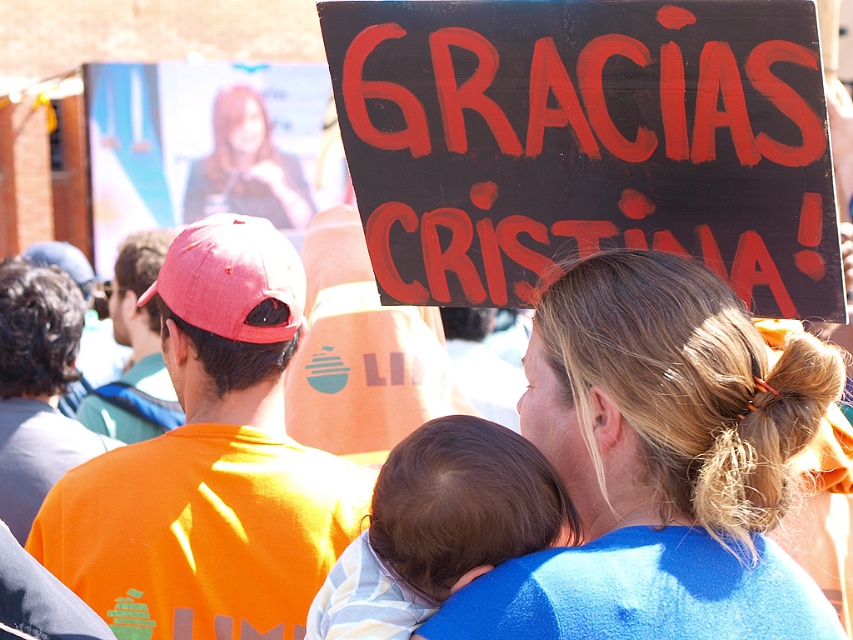
Looking at the scene, where is the blonde hair at upper center in relation to the soft white fabric at center?

The blonde hair at upper center is located to the right of the soft white fabric at center.